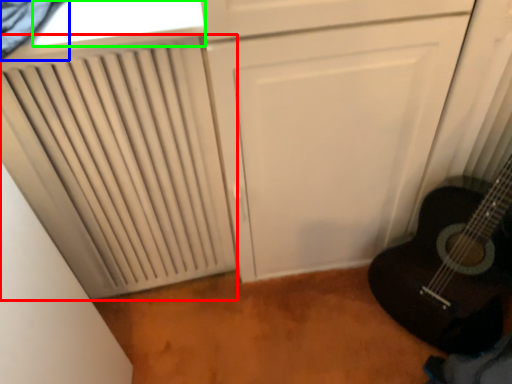
Question: Estimate the real-world distances between objects in this image. Which object is farther from radiator (highlighted by a red box), curtain (highlighted by a blue box) or window (highlighted by a green box)?

Choices:
 (A) curtain
 (B) window

Answer: (A)